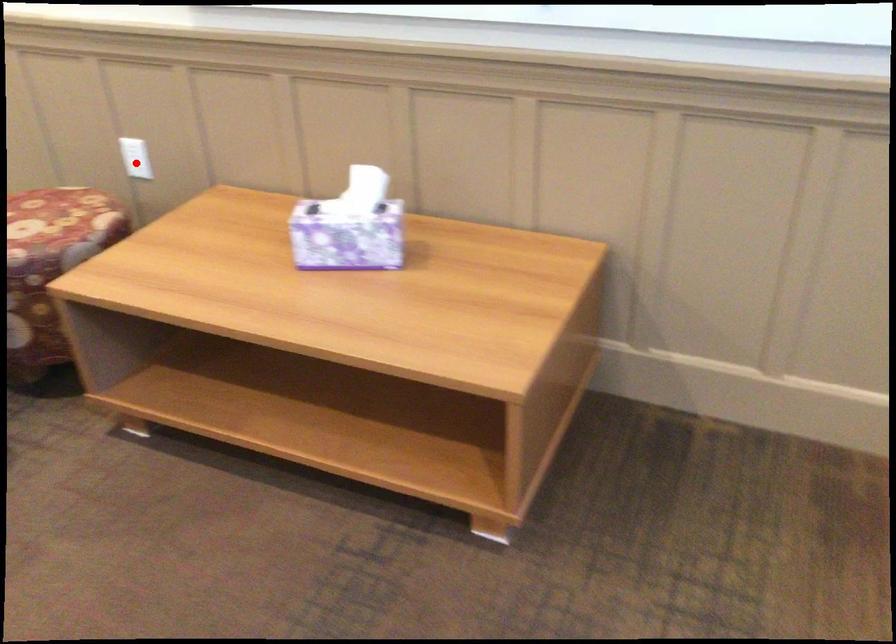
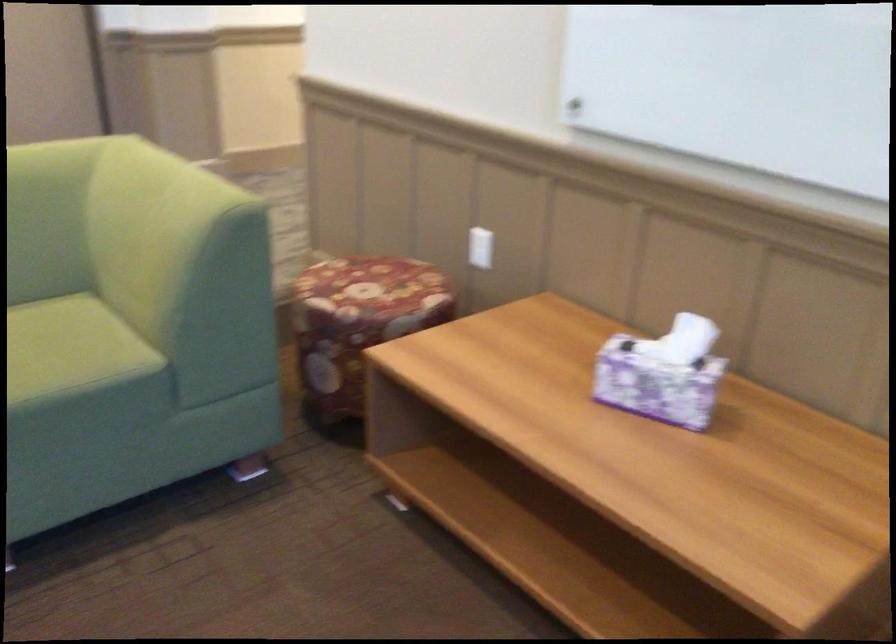
The point at the highlighted location is marked in the first image. Where is the corresponding point in the second image?

(479, 247)